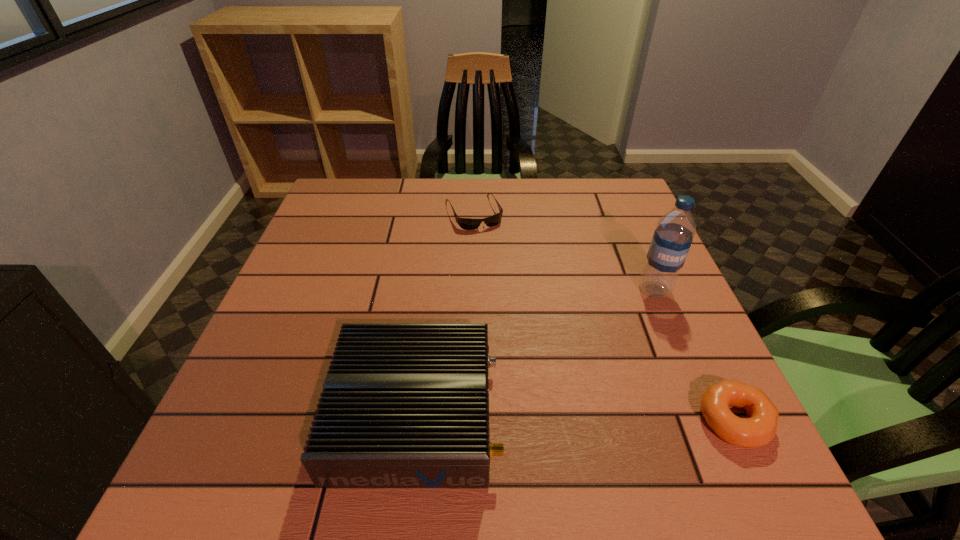
I want to click on free space at the far edge, so click(512, 183).

Where is `vacant space at the left edge of the desktop`? This screenshot has height=540, width=960. vacant space at the left edge of the desktop is located at coordinates (318, 253).

Find the location of `vacant space at the right edge of the desktop`. vacant space at the right edge of the desktop is located at coordinates (672, 377).

Image resolution: width=960 pixels, height=540 pixels. In order to click on vacant space at the far left corner of the desktop in this screenshot , I will do `click(368, 200)`.

In order to click on blank space at the far right corner in this screenshot , I will do `click(613, 190)`.

Locate an element on the screen. This screenshot has width=960, height=540. unoccupied position between the third tallest object and the shortest object is located at coordinates (604, 315).

Where is `free spot between the second tallest object and the sunglasses`? This screenshot has width=960, height=540. free spot between the second tallest object and the sunglasses is located at coordinates (444, 313).

Where is `free spot between the tallest object and the third tallest object`? free spot between the tallest object and the third tallest object is located at coordinates (694, 355).

This screenshot has height=540, width=960. What are the coordinates of `free point between the third tallest object and the farthest object` in the screenshot? It's located at (604, 315).

The height and width of the screenshot is (540, 960). Find the location of `empty space between the shortest object and the water bottle`. empty space between the shortest object and the water bottle is located at coordinates (564, 251).